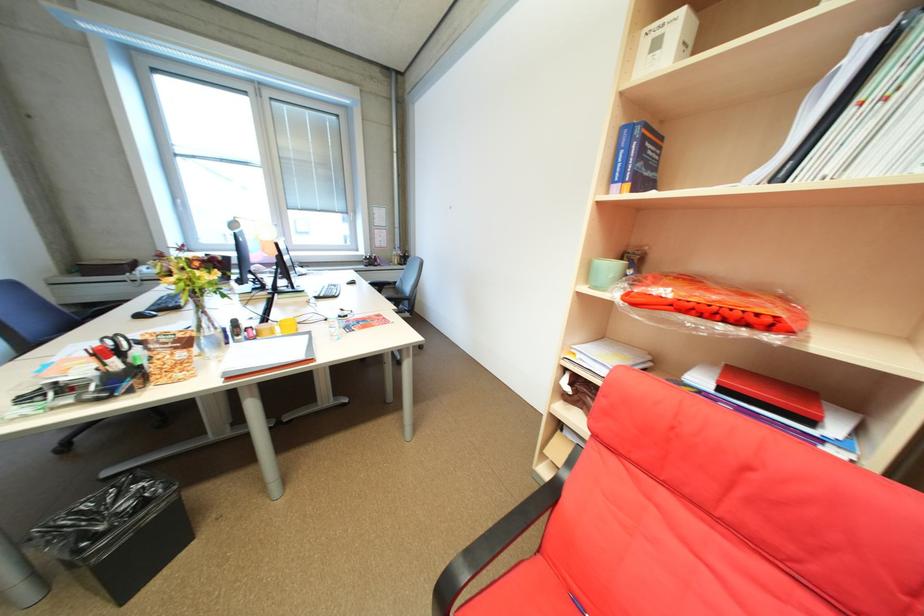
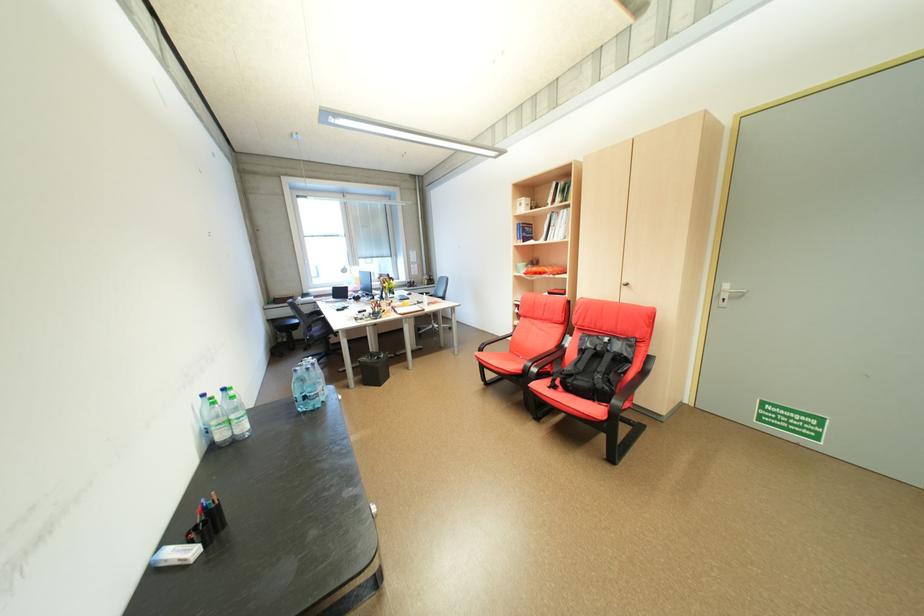
In the second image, find the point that corresponds to (651,140) in the first image.

(532, 228)